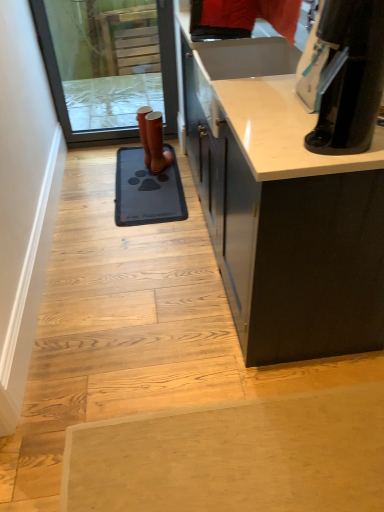
Question: Is blue rubber doormat at center looking in the opposite direction of white smooth door at left?

Choices:
 (A) no
 (B) yes

Answer: (A)

Question: Does blue rubber doormat at center have a larger size compared to white smooth door at left?

Choices:
 (A) no
 (B) yes

Answer: (A)

Question: Is the position of blue rubber doormat at center less distant than that of white smooth door at left?

Choices:
 (A) yes
 (B) no

Answer: (B)

Question: Is blue rubber doormat at center oriented towards white smooth door at left?

Choices:
 (A) no
 (B) yes

Answer: (A)

Question: From a real-world perspective, is blue rubber doormat at center positioned over white smooth door at left based on gravity?

Choices:
 (A) no
 (B) yes

Answer: (A)

Question: Is transparent glass screen door at upper left situated inside brown leather boot at center or outside?

Choices:
 (A) outside
 (B) inside

Answer: (A)

Question: From their relative heights in the image, would you say transparent glass screen door at upper left is taller or shorter than brown leather boot at center?

Choices:
 (A) tall
 (B) short

Answer: (A)

Question: Relative to brown leather boot at center, is transparent glass screen door at upper left in front or behind?

Choices:
 (A) behind
 (B) front

Answer: (B)

Question: From a real-world perspective, relative to brown leather boot at center, is transparent glass screen door at upper left vertically above or below?

Choices:
 (A) below
 (B) above

Answer: (B)

Question: In terms of width, does white smooth door at left look wider or thinner when compared to brown leather boot at center?

Choices:
 (A) wide
 (B) thin

Answer: (B)

Question: From the image's perspective, is white smooth door at left above or below brown leather boot at center?

Choices:
 (A) below
 (B) above

Answer: (A)

Question: From a real-world perspective, is white smooth door at left above or below brown leather boot at center?

Choices:
 (A) above
 (B) below

Answer: (B)

Question: Is white smooth door at left inside or outside of brown leather boot at center?

Choices:
 (A) outside
 (B) inside

Answer: (A)

Question: Considering the positions of blue rubber doormat at center and white smooth door at left in the image, is blue rubber doormat at center wider or thinner than white smooth door at left?

Choices:
 (A) thin
 (B) wide

Answer: (B)

Question: Relative to white smooth door at left, is blue rubber doormat at center in front or behind?

Choices:
 (A) behind
 (B) front

Answer: (A)